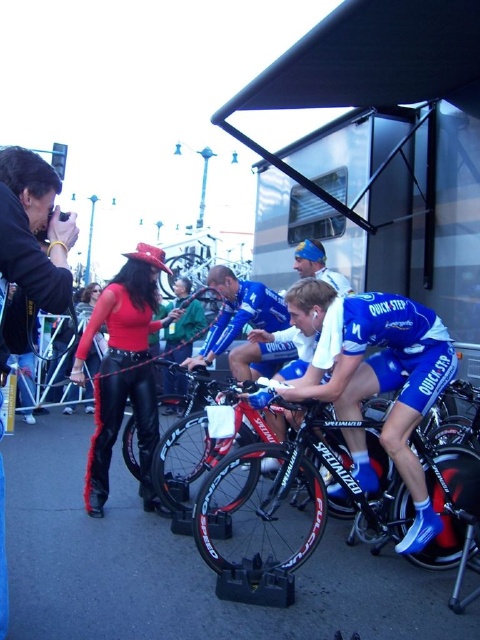
You are a photographer standing at the event. You want to take a closeup photo of the shiny black bike at center without moving any objects. Can you step closer to get a better shot? The minimum safe distance you can stand is 2 meters from the bike.

The shiny black bike at center is 2.74 meters away from the viewer. Since the minimum safe distance is 2 meters, you can step closer to get a better shot as the current distance allows moving within the safe range.

You are a photographer positioned at the edge of the scene. You need to capture a photo that includes both the blue matte bicycle at center and the shiny black bike at center. What is the minimum distance you need to move backward to ensure both bikes are fully in frame?

The minimum distance to move backward would depend on the camera lens and sensor size, which are not provided. However, since the bikes are 14.32 inches apart, you need to ensure your camera can capture that distance within the frame at your current position. If they are currently overlapping or too close, moving back may help, but exact distance can not be calculated without additional information.

You are a photographer at the event and need to capture a photo where both the blue matte bicycle at center and the blue jersey at center are visible. Based on their positions, which object should you focus on first to ensure both are in frame?

The blue matte bicycle at center is below the blue jersey at center, so you should focus on the blue jersey at center first to ensure both are in frame.